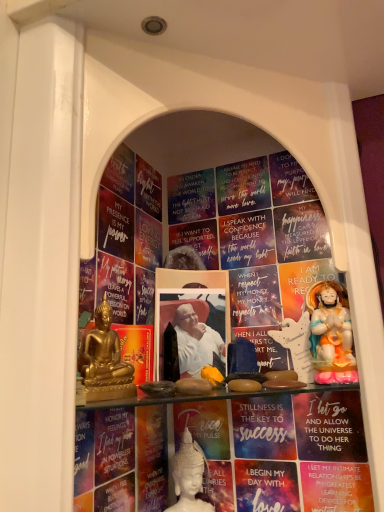
Find the location of a particular element. The height and width of the screenshot is (512, 384). matte gold statue at right is located at coordinates (297, 345).

Which is closer to the camera, (303, 344) or (243, 450)?

The point (303, 344) is more forward.

Can you see matte gold statue at right touching matte blue paperback book at center, the 3th paperback book from the left?

Yes, matte gold statue at right is with matte blue paperback book at center, the 3th paperback book from the left.

From the image's perspective, does matte gold statue at right appear lower than matte blue paperback book at center, the first paperback book in the right-to-left sequence?

No, from the image's perspective, matte gold statue at right is not below matte blue paperback book at center, the first paperback book in the right-to-left sequence.

Based on the photo, are white paper at center, which is counted as the 2th paperback book, starting from the right, and matte gold statue at right located far from each other?

No.

From the image's perspective, is white paper at center, which is counted as the 2th paperback book, starting from the right, positioned above or below matte gold statue at right?

From the image's perspective, white paper at center, which is counted as the 2th paperback book, starting from the right, appears above matte gold statue at right.

Is the position of white paper at center, placed as the 2th paperback book when sorted from left to right, more distant than that of matte gold statue at right?

That is False.

Between white paper at center, placed as the 2th paperback book when sorted from left to right, and matte gold statue at right, which one has smaller size?

matte gold statue at right is smaller.

Looking at this image, would you say matte gold statue at right is to the left or to the right of white porcelain statue at center, the 2th person from the left, in the picture?

matte gold statue at right is to the right of white porcelain statue at center, the 2th person from the left.

From the image's perspective, is matte gold statue at right above white porcelain statue at center, placed as the 1th person when sorted from bottom to top?

Correct, matte gold statue at right appears higher than white porcelain statue at center, placed as the 1th person when sorted from bottom to top, in the image.

Between matte gold statue at right and white porcelain statue at center, placed as the 1th person when sorted from bottom to top, which one has larger size?

With larger size is white porcelain statue at center, placed as the 1th person when sorted from bottom to top.

Is matte gold statue at right aimed at white porcelain statue at center, the 3th person from the top?

No, matte gold statue at right is not oriented towards white porcelain statue at center, the 3th person from the top.

Does point (186, 504) lie in front of point (96, 318)?

No, (186, 504) is further to viewer.

Locate an element on the screen. The width and height of the screenshot is (384, 512). person on the left of the white porcelain statue at center, the 3th person positioned from the front is located at coordinates (103, 353).

From the picture: Is white porcelain statue at center, placed as the 1th person when sorted from bottom to top, far from gold metallic statue at left, which is the first person from front to back?

They are positioned close to each other.

Is white porcelain statue at center, the 3th person positioned from the front, looking in the opposite direction of gold metallic statue at left, which ranks as the third person in right-to-left order?

That's not correct — white porcelain statue at center, the 3th person positioned from the front, is not looking away from gold metallic statue at left, which ranks as the third person in right-to-left order.

Does matte gold paperback book at center, the 3th paperback book when ordered from right to left, appear on the right side of matte blue paperback book at center, the first paperback book in the right-to-left sequence?

Incorrect, matte gold paperback book at center, the 3th paperback book when ordered from right to left, is not on the right side of matte blue paperback book at center, the first paperback book in the right-to-left sequence.

How many degrees apart are the facing directions of matte gold paperback book at center, the 3th paperback book when ordered from right to left, and matte blue paperback book at center, the first paperback book in the right-to-left sequence?

They differ by 56.5 degrees in their facing directions.

From a real-world perspective, does matte gold paperback book at center, arranged as the first paperback book when viewed from the left, stand above matte blue paperback book at center, the first paperback book in the right-to-left sequence?

Correct, in the physical world, matte gold paperback book at center, arranged as the first paperback book when viewed from the left, is higher than matte blue paperback book at center, the first paperback book in the right-to-left sequence.

Can you confirm if matte gold paperback book at center, arranged as the first paperback book when viewed from the left, is bigger than matte blue paperback book at center, the first paperback book in the right-to-left sequence?

Incorrect, matte gold paperback book at center, arranged as the first paperback book when viewed from the left, is not larger than matte blue paperback book at center, the first paperback book in the right-to-left sequence.

Is porcelain statue at right, the first person in the top-to-bottom sequence, inside the boundaries of gold metallic statue at left, which is the first person from front to back, or outside?

porcelain statue at right, the first person in the top-to-bottom sequence, is outside gold metallic statue at left, which is the first person from front to back.

Does porcelain statue at right, the 2th person from the front, have a smaller size compared to gold metallic statue at left, which ranks as the third person in right-to-left order?

Actually, porcelain statue at right, the 2th person from the front, might be larger than gold metallic statue at left, which ranks as the third person in right-to-left order.

Does porcelain statue at right, the first person in the top-to-bottom sequence, have a lesser height compared to gold metallic statue at left, which ranks as the third person in right-to-left order?

No, porcelain statue at right, the first person in the top-to-bottom sequence, is not shorter than gold metallic statue at left, which ranks as the third person in right-to-left order.

Starting from the porcelain statue at right, which ranks as the 1th person in right-to-left order, which person is the 2nd one to the left? Please provide its 2D coordinates.

[(103, 353)]

Are gold metallic statue at left, which ranks as the third person in right-to-left order, and white paper at center, placed as the 2th paperback book when sorted from left to right, beside each other?

No, gold metallic statue at left, which ranks as the third person in right-to-left order, is not in contact with white paper at center, placed as the 2th paperback book when sorted from left to right.

Is gold metallic statue at left, which is the first person from front to back, to the left or to the right of white paper at center, which is counted as the 2th paperback book, starting from the right, in the image?

gold metallic statue at left, which is the first person from front to back, is to the left of white paper at center, which is counted as the 2th paperback book, starting from the right.

Is white paper at center, which is counted as the 2th paperback book, starting from the right, inside gold metallic statue at left, which ranks as the third person in right-to-left order?

No, white paper at center, which is counted as the 2th paperback book, starting from the right, is not surrounded by gold metallic statue at left, which ranks as the third person in right-to-left order.

Is point (108, 357) closer or farther from the camera than point (157, 328)?

Point (108, 357) is closer to the camera than point (157, 328).

At what (x,y) coordinates should I click in order to perform the action: click on paperback book that is below the matte gold statue at right (from the image's perspective). Please return your answer as a coordinate pair (x, y). The height and width of the screenshot is (512, 384). Looking at the image, I should click on (263, 426).

Identify the location of sculpture directly beneath the white paper at center, placed as the 2th paperback book when sorted from left to right (from a real-world perspective). (297, 345).

Considering their positions, is gold metallic statue at left, arranged as the second person when ordered from the bottom, positioned further to matte gold paperback book at center, the 3th paperback book when ordered from right to left, than matte blue paperback book at center, the 3th paperback book from the left?

The object further to matte gold paperback book at center, the 3th paperback book when ordered from right to left, is matte blue paperback book at center, the 3th paperback book from the left.

When comparing their distances from matte gold statue at right, does porcelain statue at right, which ranks as the 1th person in right-to-left order, or matte gold paperback book at center, arranged as the first paperback book when viewed from the left, seem further?

matte gold paperback book at center, arranged as the first paperback book when viewed from the left, is further to matte gold statue at right.

Which object lies further to the anchor point matte gold statue at right, white paper at center, placed as the 2th paperback book when sorted from left to right, or matte blue paperback book at center, the 3th paperback book from the left?

white paper at center, placed as the 2th paperback book when sorted from left to right.

Based on the photo, considering their positions, is matte gold paperback book at center, the 3th paperback book when ordered from right to left, positioned further to porcelain statue at right, the 2th person from the front, than gold metallic statue at left, which ranks as the first person in left-to-right order?

gold metallic statue at left, which ranks as the first person in left-to-right order.

Considering their positions, is porcelain statue at right, the third person in the left-to-right sequence, positioned closer to matte blue paperback book at center, the first paperback book in the right-to-left sequence, than matte gold statue at right?

matte gold statue at right is closer to matte blue paperback book at center, the first paperback book in the right-to-left sequence.

In the scene shown: Which object lies nearer to the anchor point matte gold statue at right, matte blue paperback book at center, the first paperback book in the right-to-left sequence, or white porcelain statue at center, the 3th person positioned from the front?

matte blue paperback book at center, the first paperback book in the right-to-left sequence, is closer to matte gold statue at right.

Based on their spatial positions, is matte gold statue at right or white paper at center, which is counted as the 2th paperback book, starting from the right, further from porcelain statue at right, the first person in the top-to-bottom sequence?

Among the two, white paper at center, which is counted as the 2th paperback book, starting from the right, is located further to porcelain statue at right, the first person in the top-to-bottom sequence.

When comparing their distances from gold metallic statue at left, placed as the 2th person when sorted from top to bottom, does matte blue paperback book at center, the 3th paperback book from the left, or matte gold paperback book at center, the 3th paperback book when ordered from right to left, seem further?

Among the two, matte blue paperback book at center, the 3th paperback book from the left, is located further to gold metallic statue at left, placed as the 2th person when sorted from top to bottom.

Find the location of a particular element. The image size is (384, 512). paperback book that lies between matte gold statue at right and white porcelain statue at center, placed as the 1th person when sorted from bottom to top, from top to bottom is located at coordinates (263, 426).

Identify the location of paperback book that lies between matte gold paperback book at center, the 3th paperback book when ordered from right to left, and white porcelain statue at center, the 3th person from the top, from top to bottom. The height and width of the screenshot is (512, 384). (263, 426).

The height and width of the screenshot is (512, 384). I want to click on sculpture between white paper at center, which is counted as the 2th paperback book, starting from the right, and white porcelain statue at center, placed as the 1th person when sorted from bottom to top, in the up-down direction, so click(x=297, y=345).

Locate an element on the screen. sculpture between porcelain statue at right, which ranks as the 1th person in right-to-left order, and white porcelain statue at center, the 3th person from the top, from top to bottom is located at coordinates (297, 345).